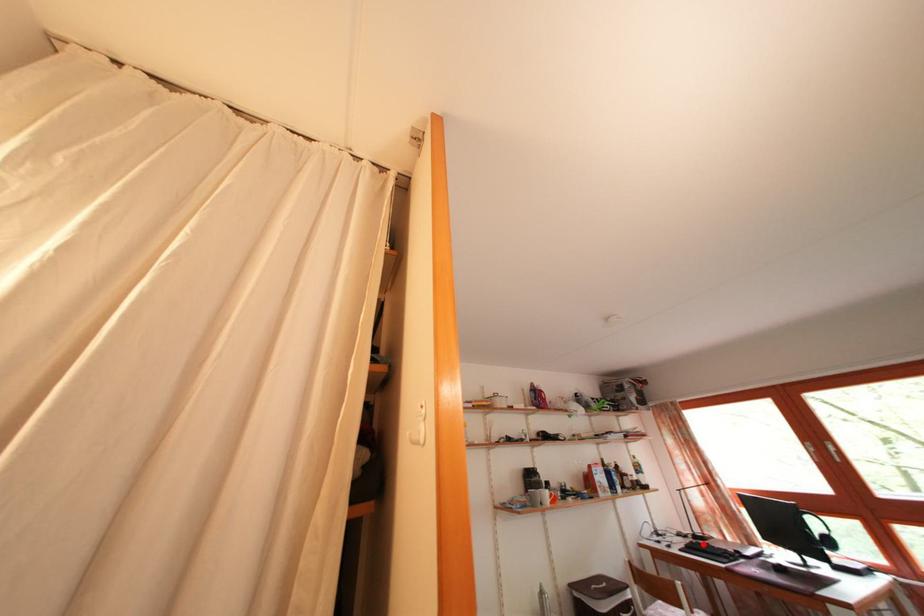
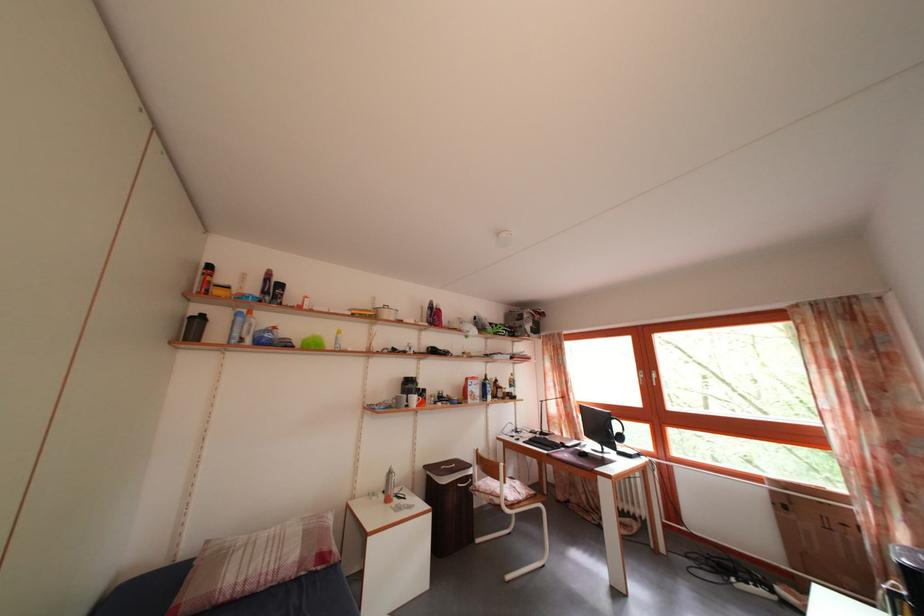
Question: I am providing you with two images of the same scene from different viewpoints. Given a red point in image1, look at the same physical point in image2. Is it:

Choices:
 (A) Closer to the viewpoint
 (B) Farther from the viewpoint

Answer: (B)